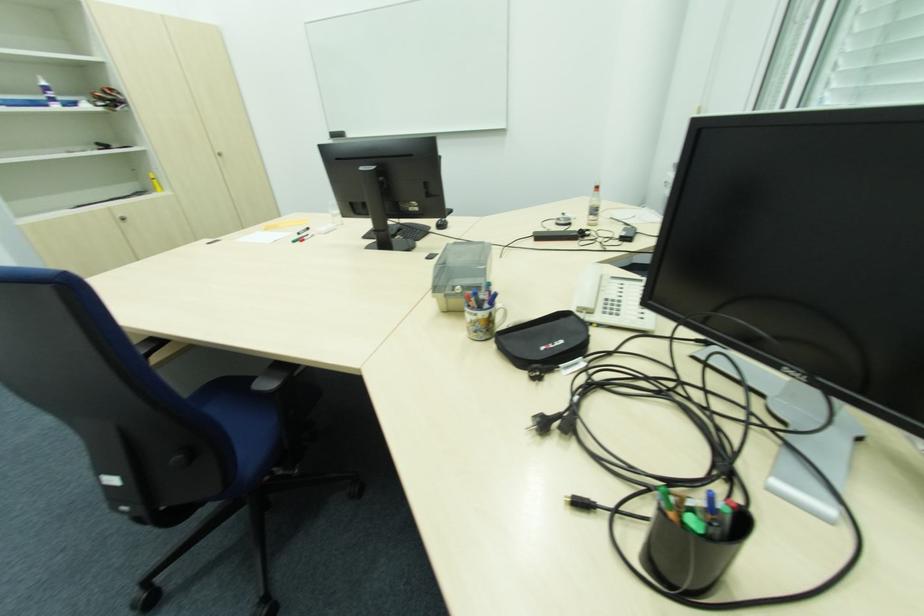
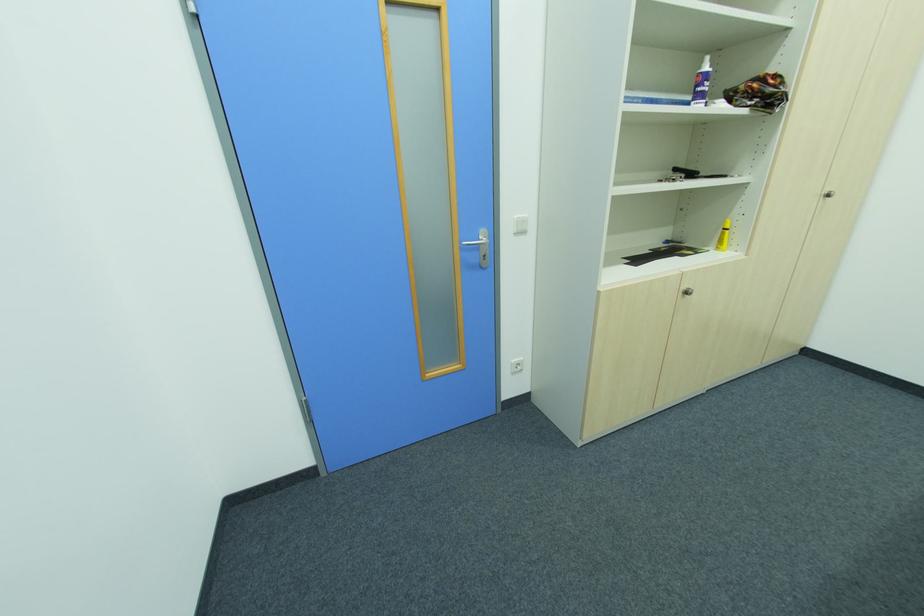
The point at [128,220] is marked in the first image. Where is the corresponding point in the second image?

(689, 294)